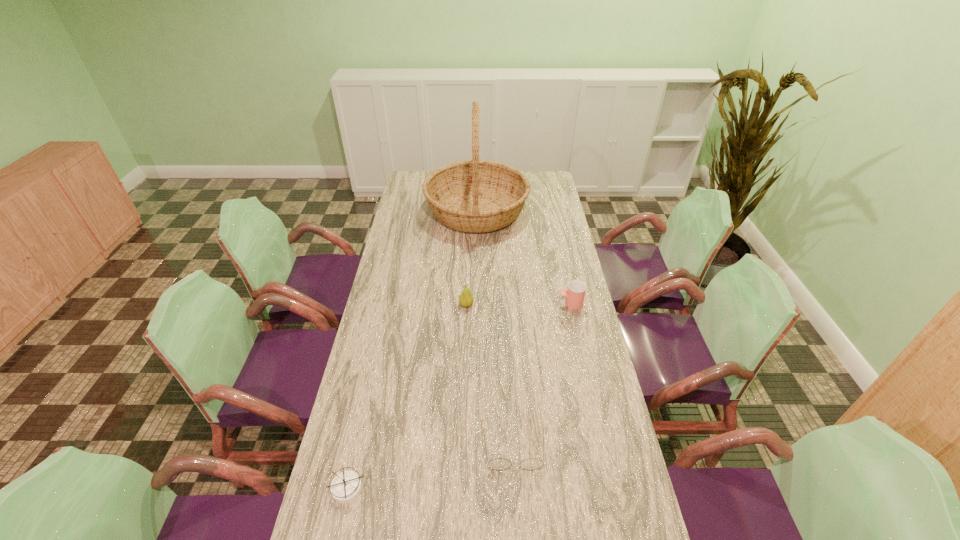
Find the location of a particular element. Image resolution: width=960 pixels, height=540 pixels. free space located on the side of the cup with the handle is located at coordinates (493, 303).

At what (x,y) coordinates should I click in order to perform the action: click on free space located 0.120m on the side of the cup with the handle. Please return your answer as a coordinate pair (x, y). Image resolution: width=960 pixels, height=540 pixels. Looking at the image, I should click on (525, 303).

Identify the location of vacant space situated on the side of the cup with the handle. (501, 303).

Identify the location of free spot located 0.100m on the temples of the fourth tallest object. (517, 513).

This screenshot has width=960, height=540. Identify the location of vacant space located on the back of the shortest object. (372, 379).

In order to click on object that is at the far edge in this screenshot , I will do `click(475, 196)`.

You are a GUI agent. You are given a task and a screenshot of the screen. Output one action in this format:
    pyautogui.click(x=<x>, y=<y>)
    Task: Click on the basket that is positioned at the left edge
    The image size is (960, 540).
    Given the screenshot: What is the action you would take?
    pyautogui.click(x=475, y=196)

At what (x,y) coordinates should I click in order to perform the action: click on compass that is at the left edge. Please return your answer as a coordinate pair (x, y). Image resolution: width=960 pixels, height=540 pixels. Looking at the image, I should click on (346, 486).

In order to click on basket at the right edge in this screenshot , I will do `click(475, 196)`.

Find the location of a particular element. cup that is at the right edge is located at coordinates (575, 294).